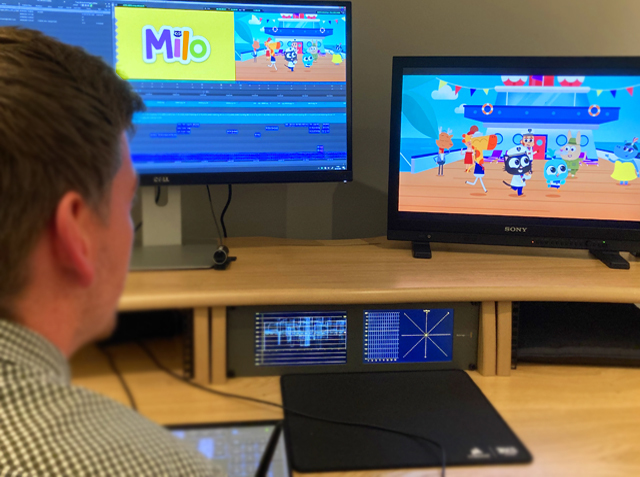
I want to click on tiered wooden desk, so pos(349,263), pos(586,407), pos(160,399).